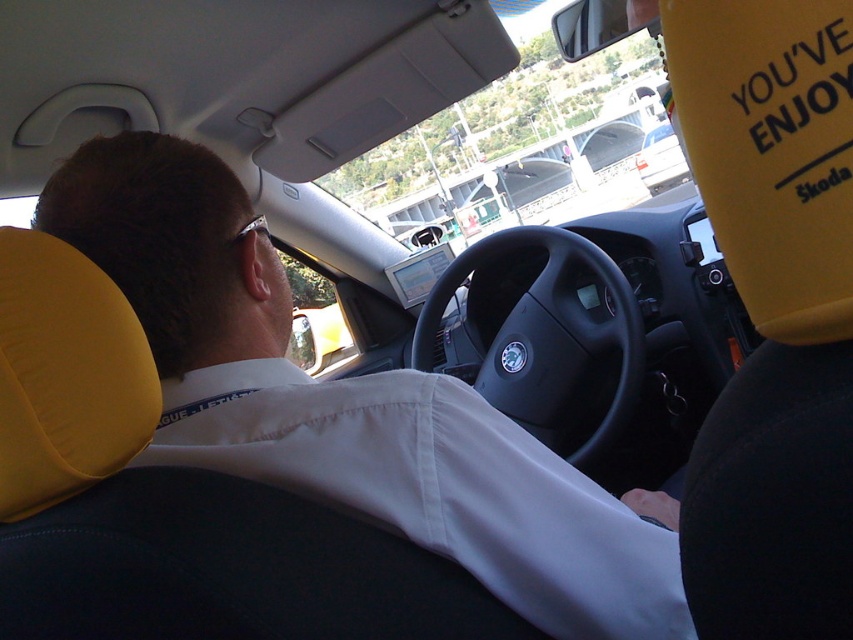
You are sitting in the passenger seat of the car and notice the white fabric shirt at upper left and the black matte steering wheel at center. Which object takes up more space in the image?

The black matte steering wheel at center takes up more space in the image than the white fabric shirt at upper left because the white fabric shirt at upper left occupies less space than black matte steering wheel at center.

You are a passenger in a car and want to know if you can safely reach the white matte van at center from the black matte steering wheel at center without moving your seat. The minimum safe distance required is 15 meters. Is the current distance sufficient?

The black matte steering wheel at center and white matte van at center are 13.44 meters apart, which is less than the required 15 meters. Therefore, the current distance is not sufficient for safe reaching without moving your seat.

You are sitting in the passenger seat of a car and see the black matte steering wheel at center and the white matte van at center. Which object is located to the left of the other?

The black matte steering wheel at center is positioned on the left side of white matte van at center.